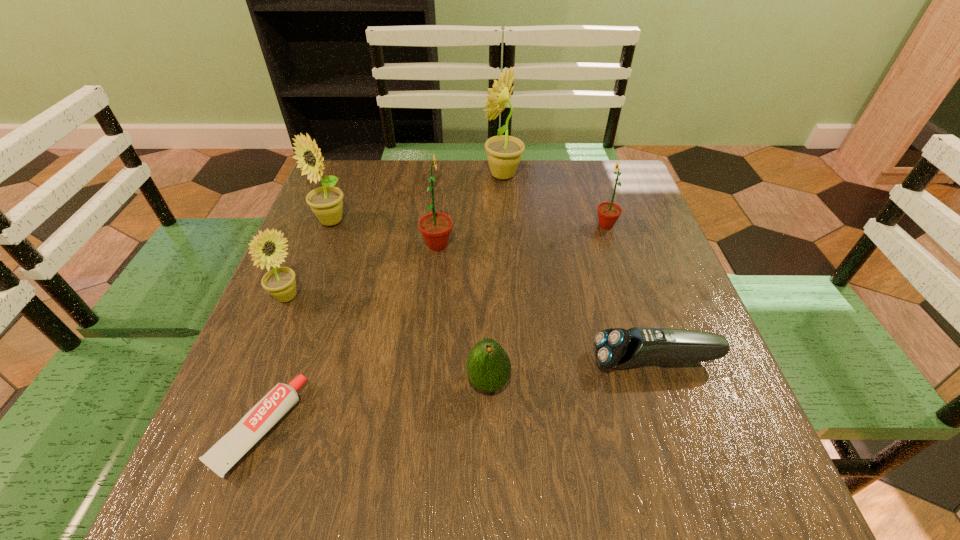
You are a GUI agent. You are given a task and a screenshot of the screen. Output one action in this format:
    pyautogui.click(x=<x>, y=<y>)
    Task: Click on the sunflower located at the right edge
    The image size is (960, 540).
    Given the screenshot: What is the action you would take?
    pyautogui.click(x=608, y=212)

This screenshot has width=960, height=540. In order to click on electric shaver located at the right edge in this screenshot , I will do `click(618, 348)`.

Locate an element on the screen. The height and width of the screenshot is (540, 960). object present at the near left corner is located at coordinates (222, 456).

Identify the location of vacant area at the far edge of the desktop. Image resolution: width=960 pixels, height=540 pixels. (401, 190).

At what (x,y) coordinates should I click in order to perform the action: click on vacant area at the near edge of the desktop. Please return your answer as a coordinate pair (x, y). This screenshot has height=540, width=960. Looking at the image, I should click on [x=492, y=460].

Where is `vacant area at the left edge of the desktop`? This screenshot has width=960, height=540. vacant area at the left edge of the desktop is located at coordinates (355, 221).

In order to click on vacant space at the right edge of the desktop in this screenshot , I will do `click(642, 312)`.

You are a GUI agent. You are given a task and a screenshot of the screen. Output one action in this format:
    pyautogui.click(x=<x>, y=<y>)
    Task: Click on the free spot between the toothpaste and the smaller green sunflower
    
    Given the screenshot: What is the action you would take?
    pyautogui.click(x=432, y=327)

At what (x,y) coordinates should I click in order to perform the action: click on blank region between the farthest object and the nearest yellow sunflower. Please return your answer as a coordinate pair (x, y). Image resolution: width=960 pixels, height=540 pixels. Looking at the image, I should click on (395, 236).

Image resolution: width=960 pixels, height=540 pixels. What are the coordinates of `vacant space in between the smaller green sunflower and the seventh tallest object` in the screenshot? It's located at (631, 293).